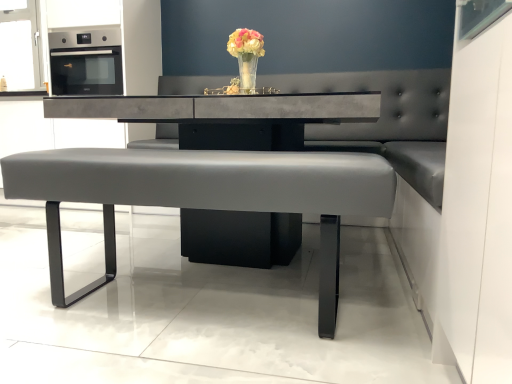
Question: Does satin black oven at upper left have a greater width compared to concrete table at center?

Choices:
 (A) yes
 (B) no

Answer: (B)

Question: Could you tell me if satin black oven at upper left is turned towards concrete table at center?

Choices:
 (A) no
 (B) yes

Answer: (A)

Question: Considering the relative sizes of satin black oven at upper left and concrete table at center in the image provided, is satin black oven at upper left thinner than concrete table at center?

Choices:
 (A) no
 (B) yes

Answer: (B)

Question: Is satin black oven at upper left located outside concrete table at center?

Choices:
 (A) no
 (B) yes

Answer: (B)

Question: Is satin black oven at upper left directly adjacent to concrete table at center?

Choices:
 (A) no
 (B) yes

Answer: (A)

Question: Considering the relative positions of matte gray bench at center and concrete table at center in the image provided, is matte gray bench at center to the left or to the right of concrete table at center?

Choices:
 (A) right
 (B) left

Answer: (B)

Question: From the image's perspective, relative to concrete table at center, is matte gray bench at center above or below?

Choices:
 (A) below
 (B) above

Answer: (A)

Question: Choose the correct answer: Is matte gray bench at center inside concrete table at center or outside it?

Choices:
 (A) inside
 (B) outside

Answer: (A)

Question: Does point (19, 173) appear closer or farther from the camera than point (224, 145)?

Choices:
 (A) closer
 (B) farther

Answer: (A)

Question: From a real-world perspective, is concrete table at center above or below satin black oven at upper left?

Choices:
 (A) above
 (B) below

Answer: (B)

Question: Considering the relative positions of concrete table at center and satin black oven at upper left in the image provided, is concrete table at center to the left or to the right of satin black oven at upper left?

Choices:
 (A) right
 (B) left

Answer: (A)

Question: Considering their positions, is concrete table at center located in front of or behind satin black oven at upper left?

Choices:
 (A) front
 (B) behind

Answer: (A)

Question: From the image's perspective, is concrete table at center located above or below satin black oven at upper left?

Choices:
 (A) above
 (B) below

Answer: (B)

Question: Does point (230, 34) appear closer or farther from the camera than point (348, 182)?

Choices:
 (A) farther
 (B) closer

Answer: (A)

Question: Considering the positions of translucent glass vase at center and matte gray bench at center in the image, is translucent glass vase at center bigger or smaller than matte gray bench at center?

Choices:
 (A) big
 (B) small

Answer: (B)